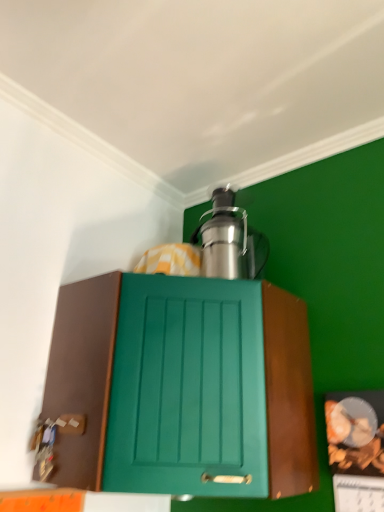
You are a GUI agent. You are given a task and a screenshot of the screen. Output one action in this format:
    pyautogui.click(x=<x>, y=<y>)
    Task: Click on the teal matte cabinet at center
    This screenshot has height=512, width=384.
    Given the screenshot: What is the action you would take?
    pyautogui.click(x=182, y=385)

What do you see at coordinates (182, 385) in the screenshot?
I see `teal matte cabinet at center` at bounding box center [182, 385].

Measure the distance between satin silver coffee maker at upper center and camera.

satin silver coffee maker at upper center is 1.31 meters away from camera.

What is the approximate height of satin silver coffee maker at upper center?

The height of satin silver coffee maker at upper center is 15.79 inches.

In order to face satin silver coffee maker at upper center, should I rotate leftwards or rightwards?

It's best to rotate right around 4.672 degrees.

What do you see at coordinates (226, 239) in the screenshot? This screenshot has width=384, height=512. I see `satin silver coffee maker at upper center` at bounding box center [226, 239].

Where is `satin silver coffee maker at upper center`? The image size is (384, 512). satin silver coffee maker at upper center is located at coordinates (226, 239).

Where is `teal matte cabinet at center`? The image size is (384, 512). teal matte cabinet at center is located at coordinates (182, 385).

Is teal matte cabinet at center to the right of satin silver coffee maker at upper center from the viewer's perspective?

Incorrect, teal matte cabinet at center is not on the right side of satin silver coffee maker at upper center.

Which object is closer to the camera taking this photo, teal matte cabinet at center or satin silver coffee maker at upper center?

teal matte cabinet at center.

Between point (305, 313) and point (246, 229), which one is positioned in front?

The point (305, 313) is closer.

From the image's perspective, is teal matte cabinet at center located beneath satin silver coffee maker at upper center?

Yes.

From a real-world perspective, relative to satin silver coffee maker at upper center, is teal matte cabinet at center vertically above or below?

teal matte cabinet at center is situated lower than satin silver coffee maker at upper center in the real world.

Consider the image. In terms of width, does teal matte cabinet at center look wider or thinner when compared to satin silver coffee maker at upper center?

teal matte cabinet at center is wider than satin silver coffee maker at upper center.

Consider the image. Which of these two, teal matte cabinet at center or satin silver coffee maker at upper center, stands taller?

Standing taller between the two is teal matte cabinet at center.

Consider the image. Looking at the image, does teal matte cabinet at center seem bigger or smaller compared to satin silver coffee maker at upper center?

In the image, teal matte cabinet at center appears to be larger than satin silver coffee maker at upper center.

Would you say teal matte cabinet at center is outside satin silver coffee maker at upper center?

Yes, teal matte cabinet at center is not within satin silver coffee maker at upper center.

Can you see teal matte cabinet at center touching satin silver coffee maker at upper center?

No, teal matte cabinet at center is not with satin silver coffee maker at upper center.

Is teal matte cabinet at center oriented towards satin silver coffee maker at upper center?

No, teal matte cabinet at center is not oriented towards satin silver coffee maker at upper center.

How many degrees apart are the facing directions of teal matte cabinet at center and satin silver coffee maker at upper center?

0.000163 degrees separate the facing orientations of teal matte cabinet at center and satin silver coffee maker at upper center.

The height and width of the screenshot is (512, 384). I want to click on cabinetry that is under the satin silver coffee maker at upper center (from a real-world perspective), so click(x=182, y=385).

In the scene shown: Which is more to the left, satin silver coffee maker at upper center or teal matte cabinet at center?

teal matte cabinet at center is more to the left.

Is satin silver coffee maker at upper center further to camera compared to teal matte cabinet at center?

Yes, satin silver coffee maker at upper center is further from the camera.

Does point (203, 269) come behind point (156, 291)?

That is True.

From the image's perspective, is satin silver coffee maker at upper center on top of teal matte cabinet at center?

Yes, from the image's perspective, satin silver coffee maker at upper center is over teal matte cabinet at center.

From a real-world perspective, is satin silver coffee maker at upper center positioned under teal matte cabinet at center based on gravity?

No, from a real-world perspective, satin silver coffee maker at upper center is not below teal matte cabinet at center.

Which of these two, satin silver coffee maker at upper center or teal matte cabinet at center, is thinner?

satin silver coffee maker at upper center is thinner.

Is satin silver coffee maker at upper center taller than teal matte cabinet at center?

Incorrect, the height of satin silver coffee maker at upper center is not larger of that of teal matte cabinet at center.

Considering the sizes of objects satin silver coffee maker at upper center and teal matte cabinet at center in the image provided, who is bigger, satin silver coffee maker at upper center or teal matte cabinet at center?

teal matte cabinet at center is bigger.

Which is correct: satin silver coffee maker at upper center is inside teal matte cabinet at center, or outside of it?

The correct answer is: outside.

Would you say satin silver coffee maker at upper center is a long distance from teal matte cabinet at center?

No, satin silver coffee maker at upper center is not far from teal matte cabinet at center.

Is satin silver coffee maker at upper center positioned with its back to teal matte cabinet at center?

satin silver coffee maker at upper center does not have its back to teal matte cabinet at center.

How many degrees apart are the facing directions of satin silver coffee maker at upper center and teal matte cabinet at center?

satin silver coffee maker at upper center and teal matte cabinet at center are facing 0.000163 degrees away from each other.

How distant is satin silver coffee maker at upper center from teal matte cabinet at center?

satin silver coffee maker at upper center is 38.92 centimeters from teal matte cabinet at center.

Image resolution: width=384 pixels, height=512 pixels. Find the location of `cabinetry to the left of satin silver coffee maker at upper center`. cabinetry to the left of satin silver coffee maker at upper center is located at coordinates (182, 385).

Locate an element on the screen. This screenshot has width=384, height=512. cabinetry in front of the satin silver coffee maker at upper center is located at coordinates point(182,385).

Where is `cabinetry that appears on the left of satin silver coffee maker at upper center`? Image resolution: width=384 pixels, height=512 pixels. cabinetry that appears on the left of satin silver coffee maker at upper center is located at coordinates (182, 385).